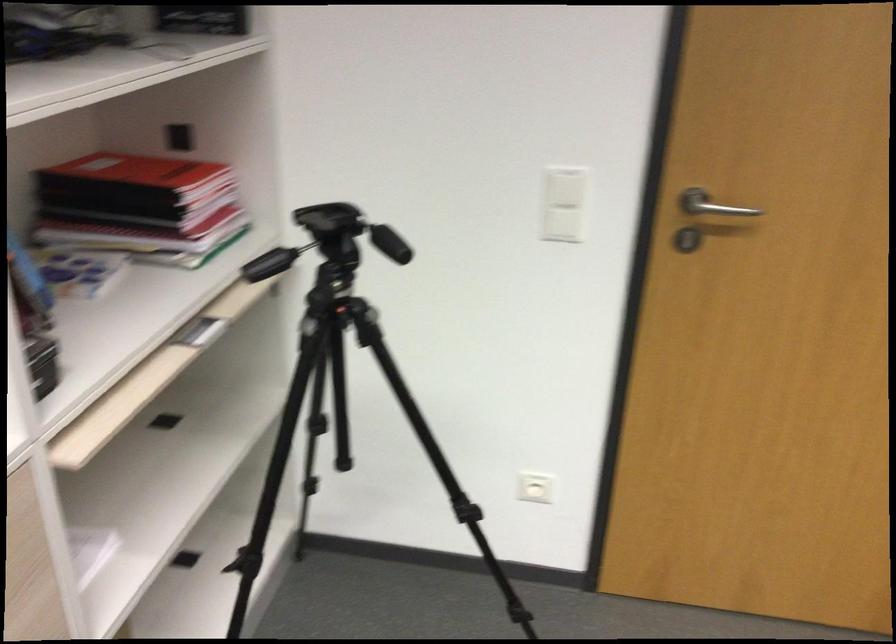
Identify the location of tripod tilt handle. (269, 263).